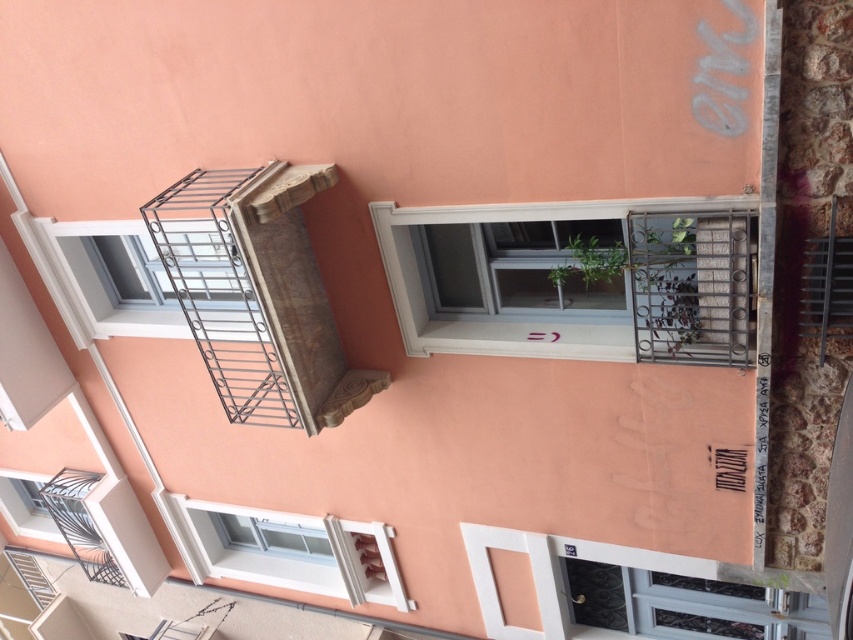
You are a window cleaner standing on the metallic silver balcony at lower left. You need to clean the white plastic window at center. Can you reach it from your current position?

The white plastic window at center is positioned over the metallic silver balcony at lower left, so yes, the window cleaner can reach it from the balcony below.